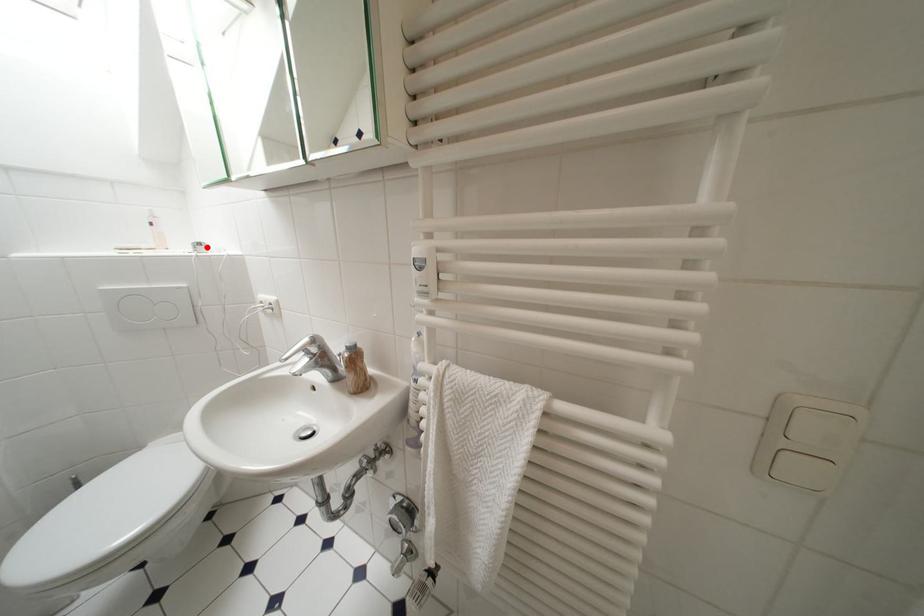
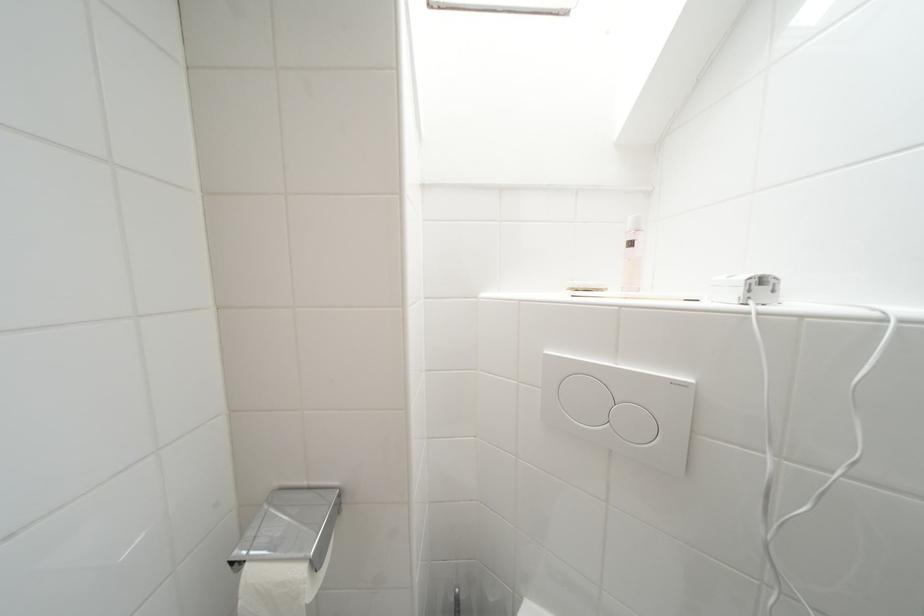
Where in the second image is the point corresponding to the highlighted location from the first image?

(769, 283)